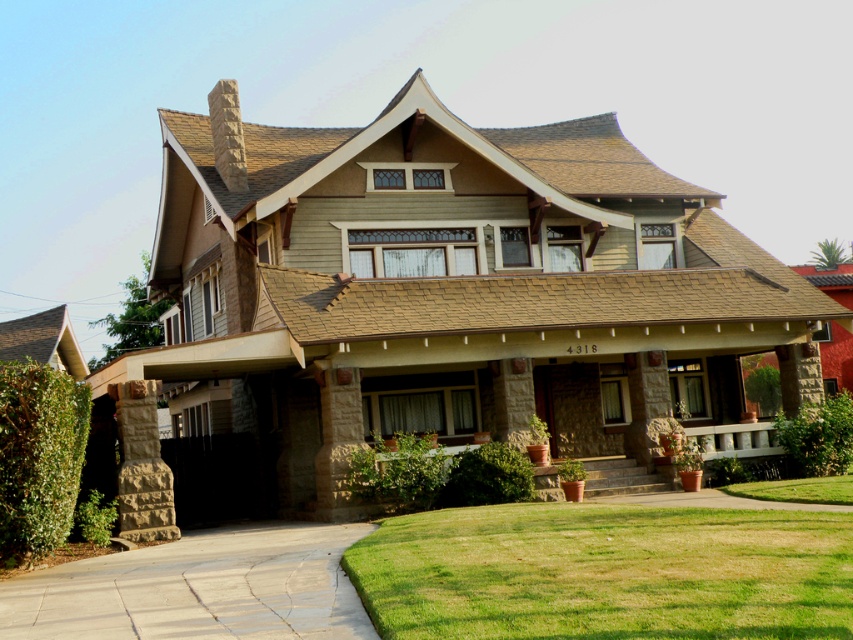
Question: Which point is closer to the camera taking this photo?

Choices:
 (A) (326, 625)
 (B) (735, 532)

Answer: (A)

Question: Does green grass at lower center have a larger size compared to smooth concrete driveway at lower left?

Choices:
 (A) yes
 (B) no

Answer: (B)

Question: Is green grass at lower center smaller than smooth concrete driveway at lower left?

Choices:
 (A) no
 (B) yes

Answer: (B)

Question: Which point is closer to the camera?

Choices:
 (A) tap(236, 548)
 (B) tap(682, 600)

Answer: (B)

Question: Is green grass at lower center positioned in front of smooth concrete driveway at lower left?

Choices:
 (A) no
 (B) yes

Answer: (B)